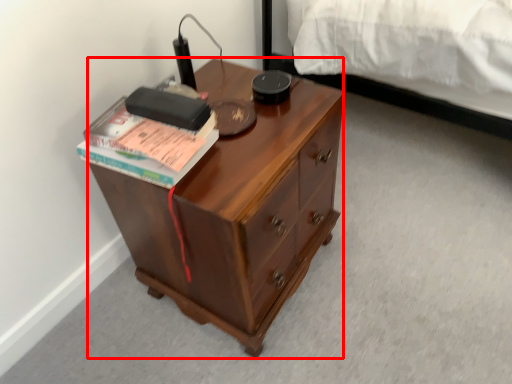
Question: Where is desk (annotated by the red box) located in relation to paperback book in the image?

Choices:
 (A) right
 (B) left

Answer: (A)